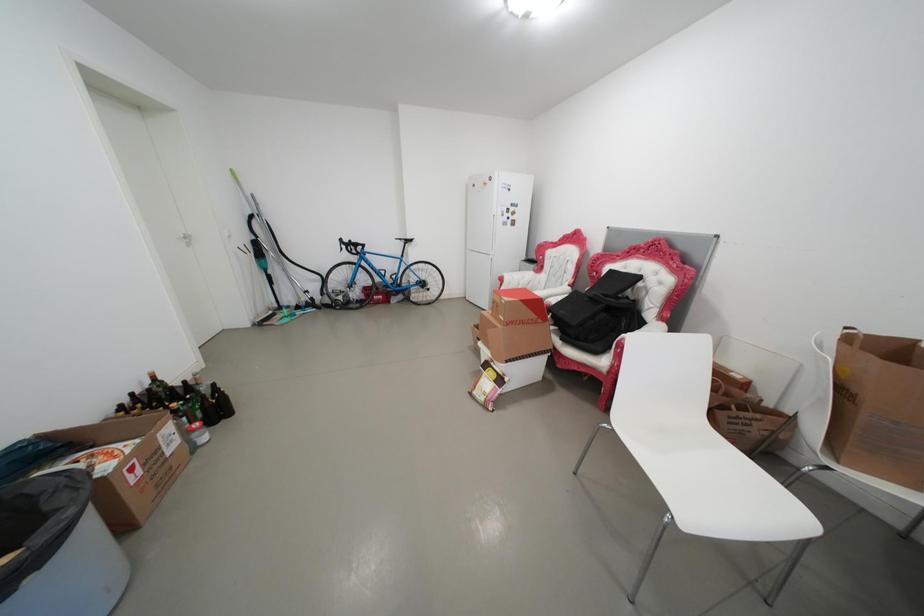
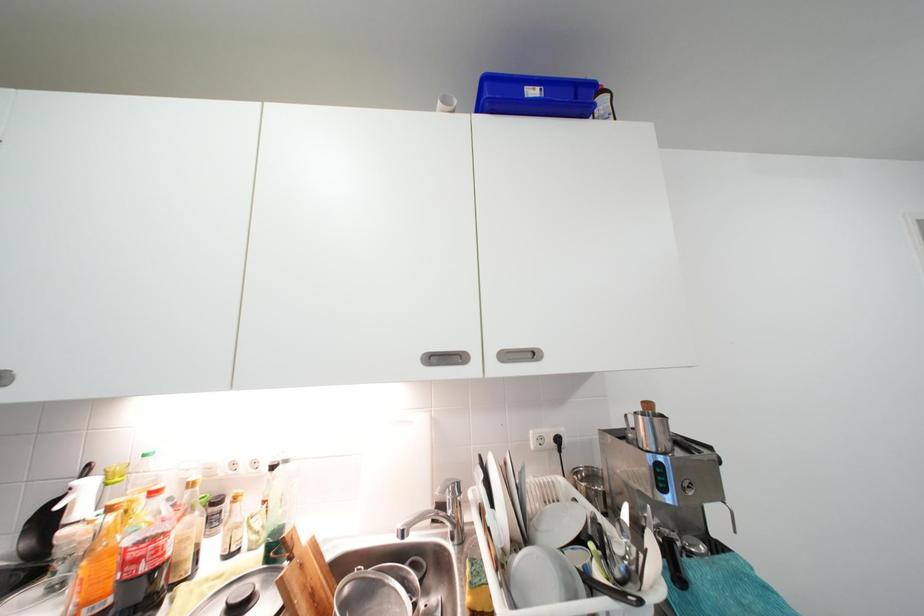
Question: The camera is either moving clockwise (left) or counter-clockwise (right) around the object. The first image is from the beginning of the video and the second image is from the end. Is the camera moving left or right when shooting the video?

Choices:
 (A) Left
 (B) Right

Answer: (B)